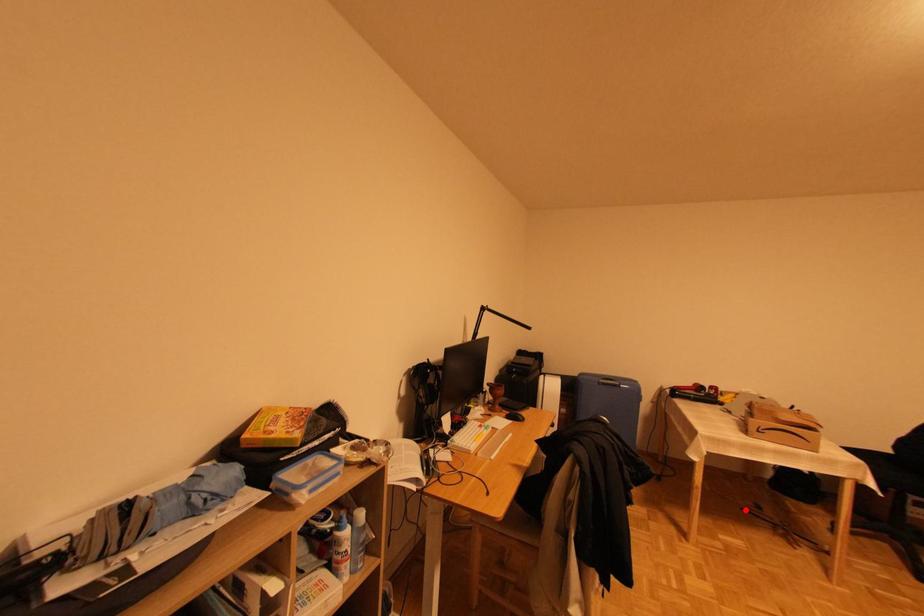
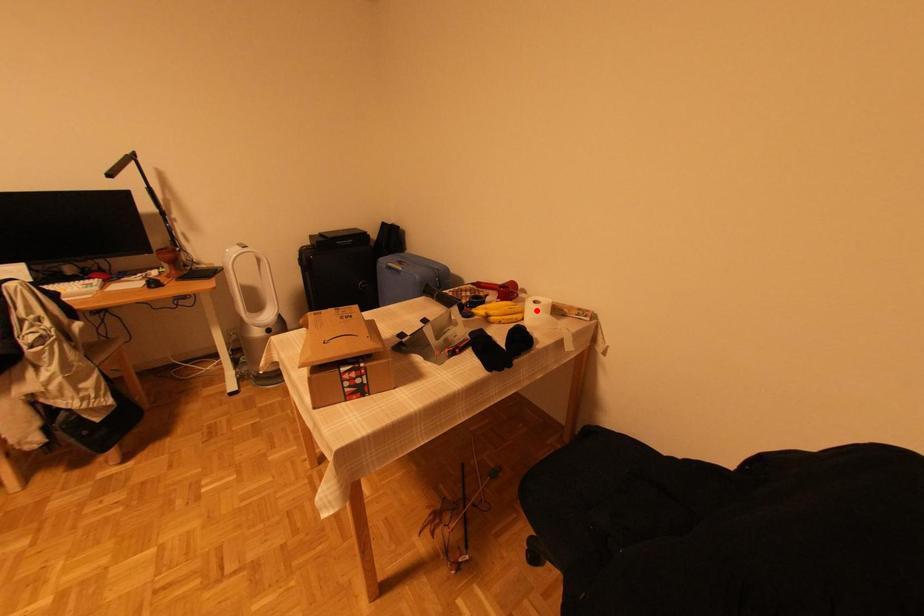
I am providing you with two images of the same scene from different viewpoints. A red point is marked on the first image and another point is marked on the second image. Do the highlighted points in image1 and image2 indicate the same real-world spot?

No